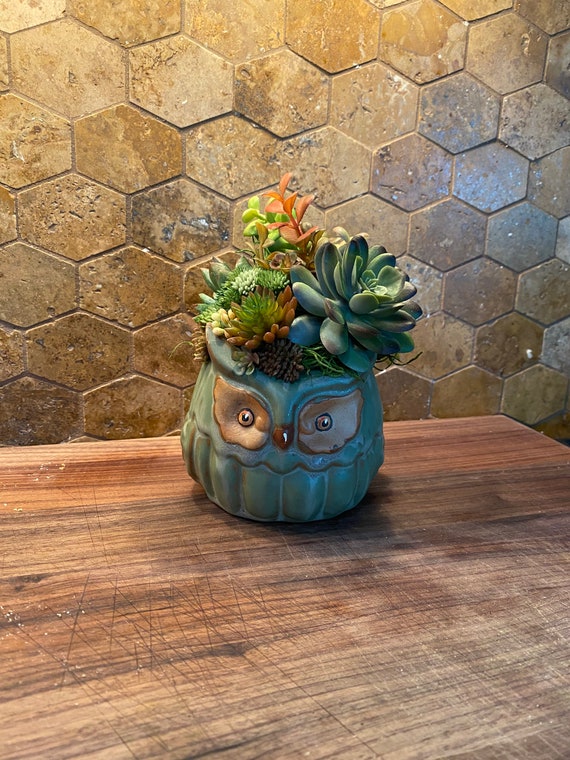
This screenshot has height=760, width=570. I want to click on wooden surface, so click(x=254, y=625).